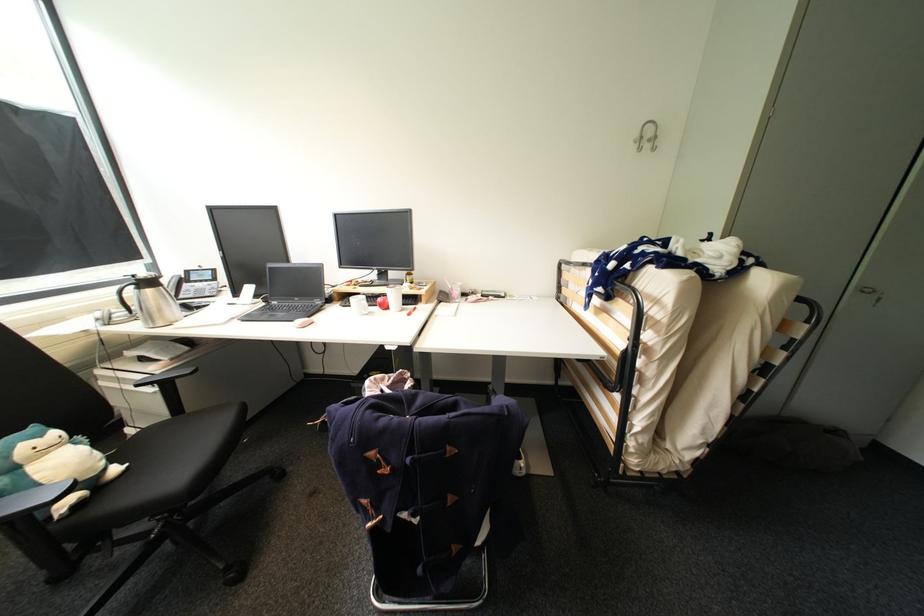
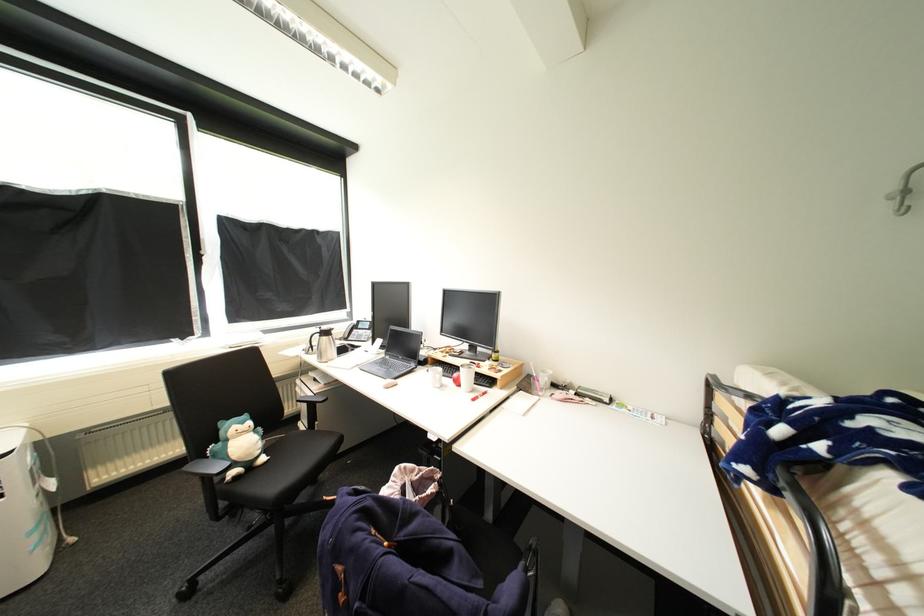
Where in the second image is the point corresponding to [459,302] from the first image?

(541, 392)